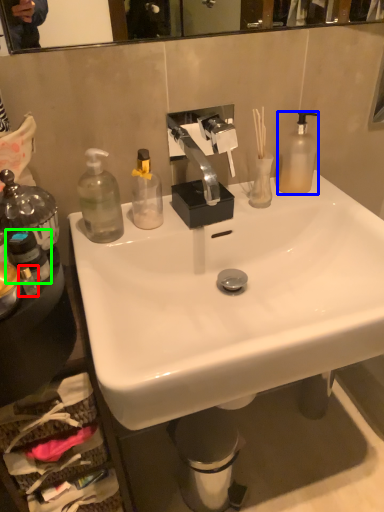
Question: Which object is the closest to the bottle (highlighted by a red box)? Choose among these: bottle (highlighted by a blue box) or bottle (highlighted by a green box).

Choices:
 (A) bottle
 (B) bottle

Answer: (B)